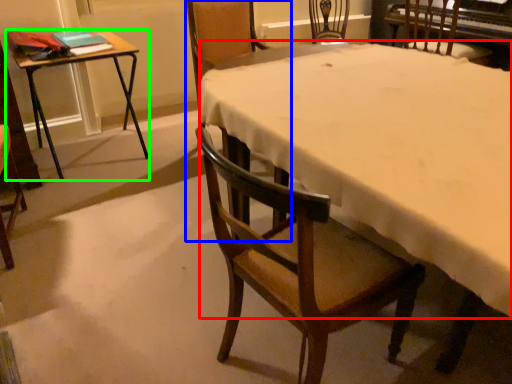
Question: Which is nearer to the tablecloth (highlighted by a red box)? chair (highlighted by a blue box) or table (highlighted by a green box).

Choices:
 (A) chair
 (B) table

Answer: (A)